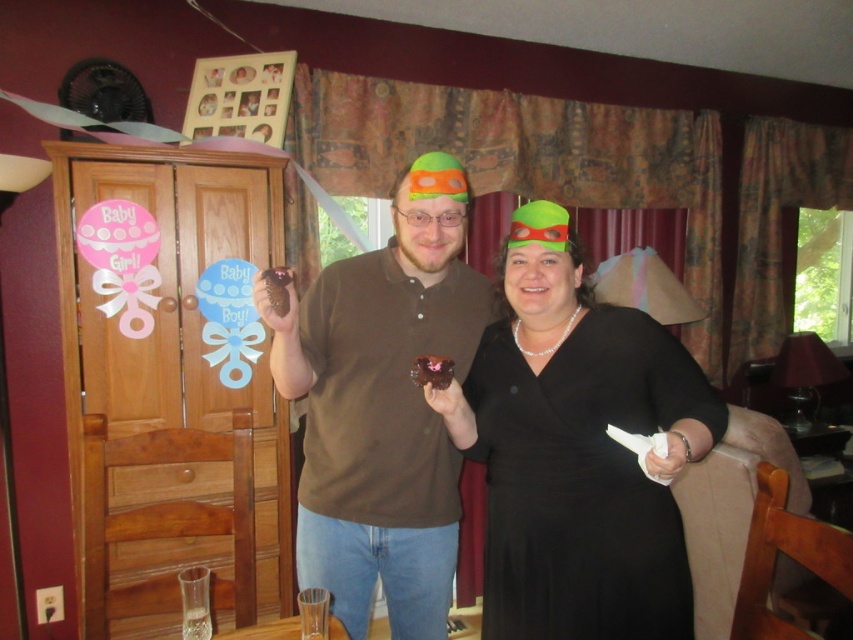
Does brown matte shirt at center appear over chocolate cake at center?

Incorrect, brown matte shirt at center is not positioned above chocolate cake at center.

This screenshot has width=853, height=640. Describe the element at coordinates (383, 406) in the screenshot. I see `brown matte shirt at center` at that location.

Locate an element on the screen. This screenshot has width=853, height=640. brown matte shirt at center is located at coordinates (383, 406).

Where is `black satin dress at center`? This screenshot has height=640, width=853. black satin dress at center is located at coordinates click(x=577, y=451).

Can you confirm if black satin dress at center is positioned below chocolate cake at center?

Indeed, black satin dress at center is positioned under chocolate cake at center.

Measure the distance between black satin dress at center and camera.

black satin dress at center and camera are 1.11 meters apart from each other.

Find the location of `black satin dress at center`. black satin dress at center is located at coordinates (577, 451).

The width and height of the screenshot is (853, 640). I want to click on chocolate cake at center, so click(432, 371).

Measure the distance between chocolate cake at center and brown matte cupcake at center.

They are 10.29 inches apart.

Which is behind, point (409, 372) or point (289, 275)?

Positioned behind is point (409, 372).

At what (x,y) coordinates should I click in order to perform the action: click on chocolate cake at center. Please return your answer as a coordinate pair (x, y). Looking at the image, I should click on (432, 371).